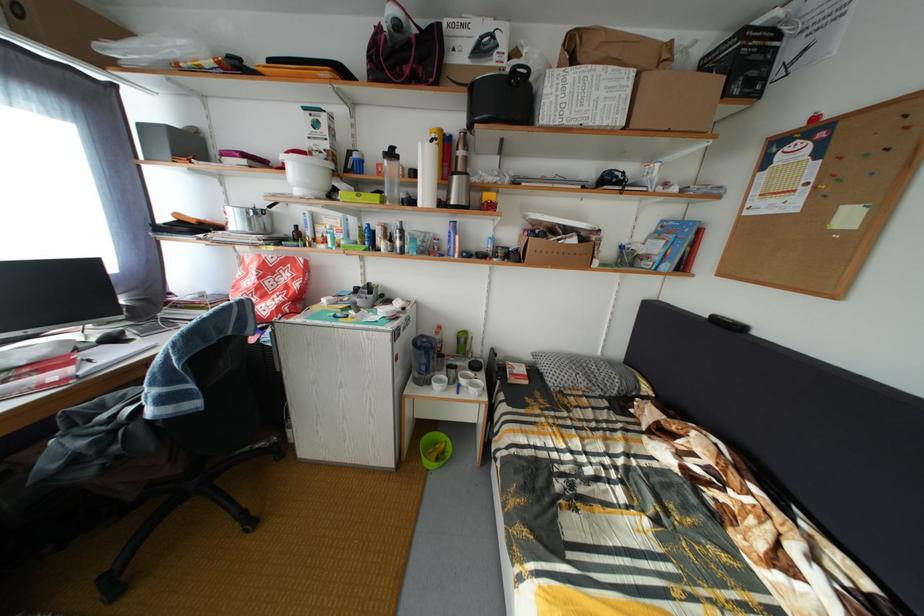
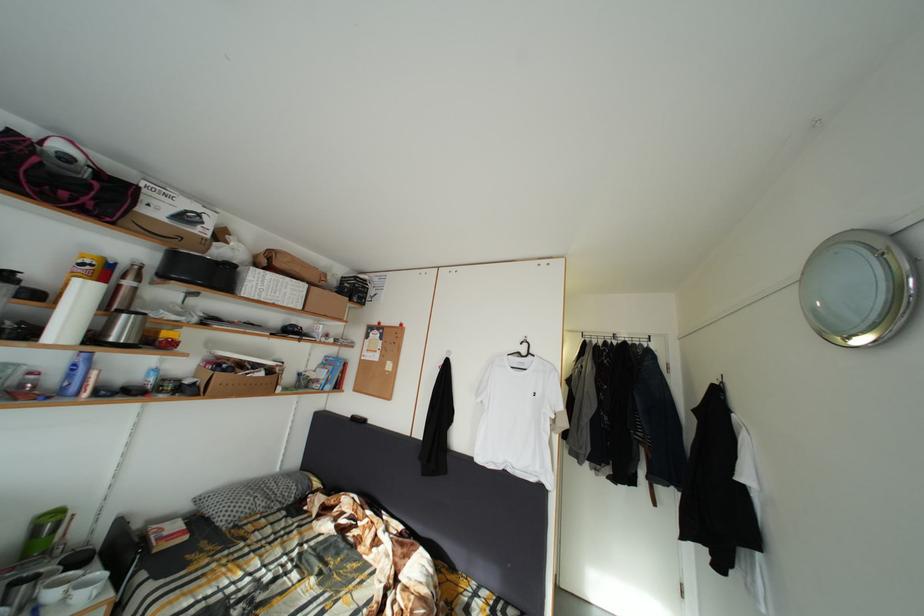
Locate, in the second image, the point that corresponds to (x=576, y=237) in the first image.

(264, 373)